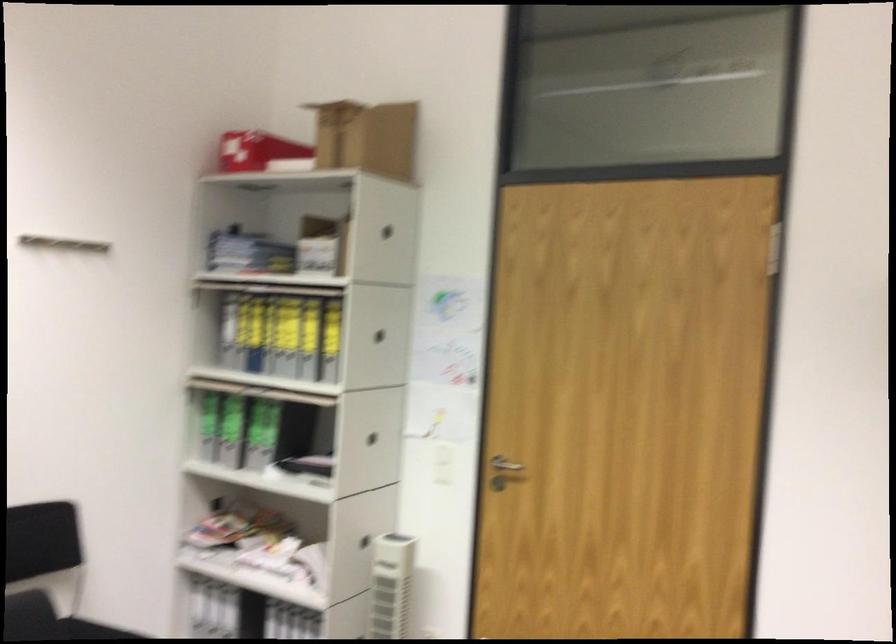
Find the location of a particular element. The width and height of the screenshot is (896, 644). red box is located at coordinates (256, 149).